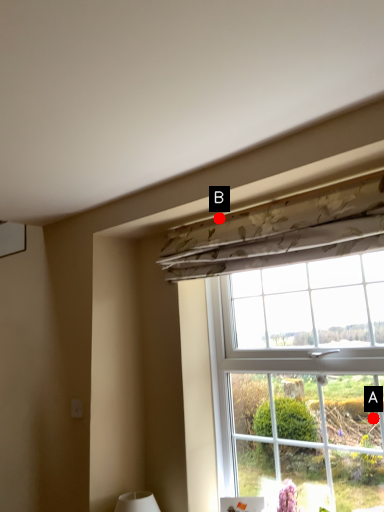
Question: Two points are circled on the image, labeled by A and B beside each circle. Which point is farther to the camera?

Choices:
 (A) A is further
 (B) B is further

Answer: (B)